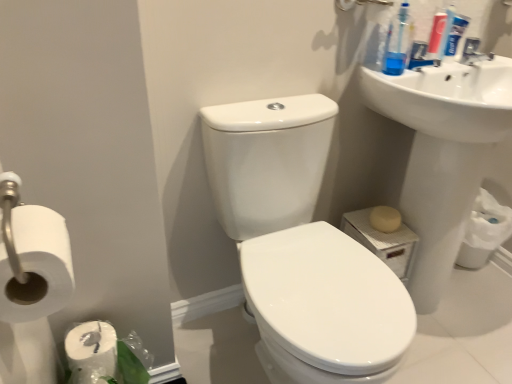
Where is `free space in front of white matte toilet paper at lower right, the 1th toilet paper viewed from the back`? This screenshot has height=384, width=512. free space in front of white matte toilet paper at lower right, the 1th toilet paper viewed from the back is located at coordinates (480, 290).